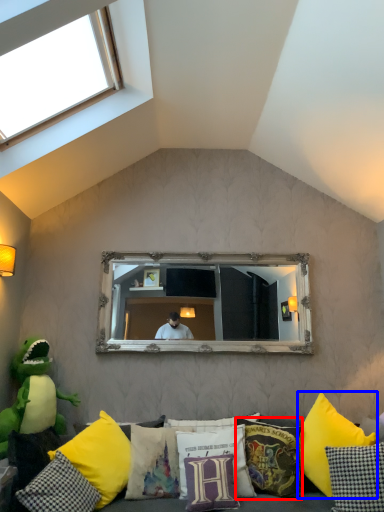
Question: Among these objects, which one is nearest to the camera, pillow (highlighted by a red box) or pillow (highlighted by a blue box)?

Choices:
 (A) pillow
 (B) pillow

Answer: (B)